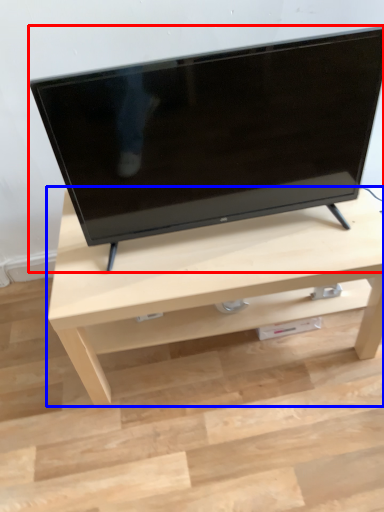
Question: Which object appears farthest to the camera in this image, television (highlighted by a red box) or table (highlighted by a blue box)?

Choices:
 (A) television
 (B) table

Answer: (B)